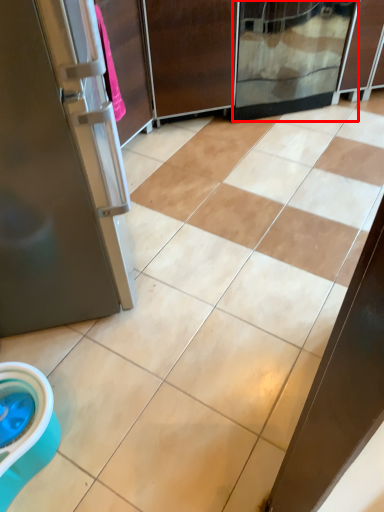
Question: Considering the relative positions of screen door (annotated by the red box) and screen door in the image provided, where is screen door (annotated by the red box) located with respect to the staircase?

Choices:
 (A) right
 (B) left

Answer: (A)